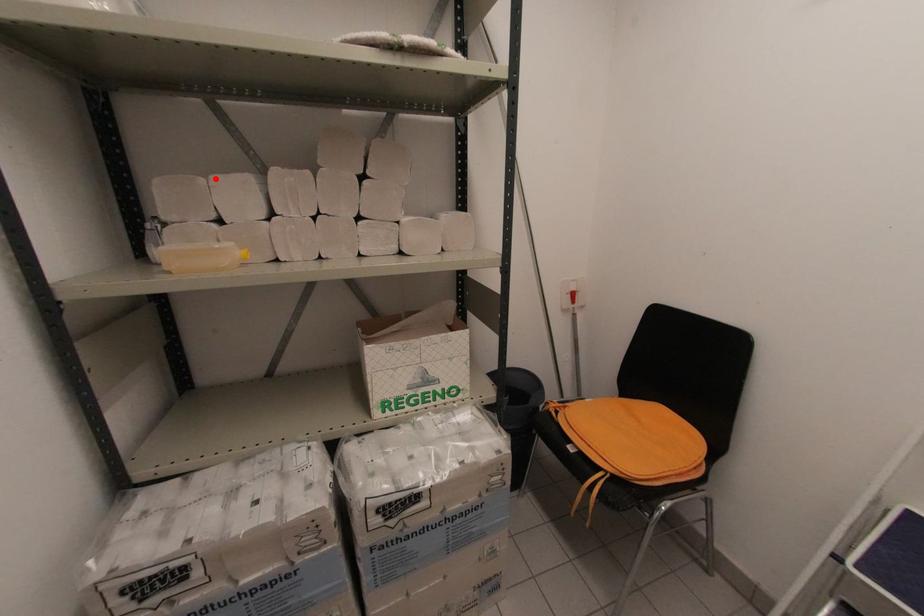
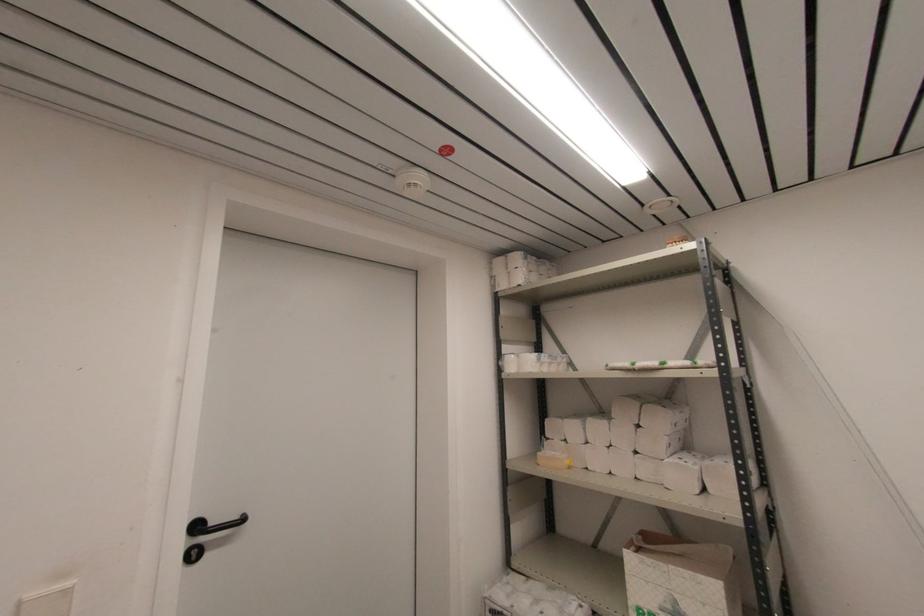
Locate, in the second image, the point that corresponds to the highlighted location in the first image.

(566, 421)